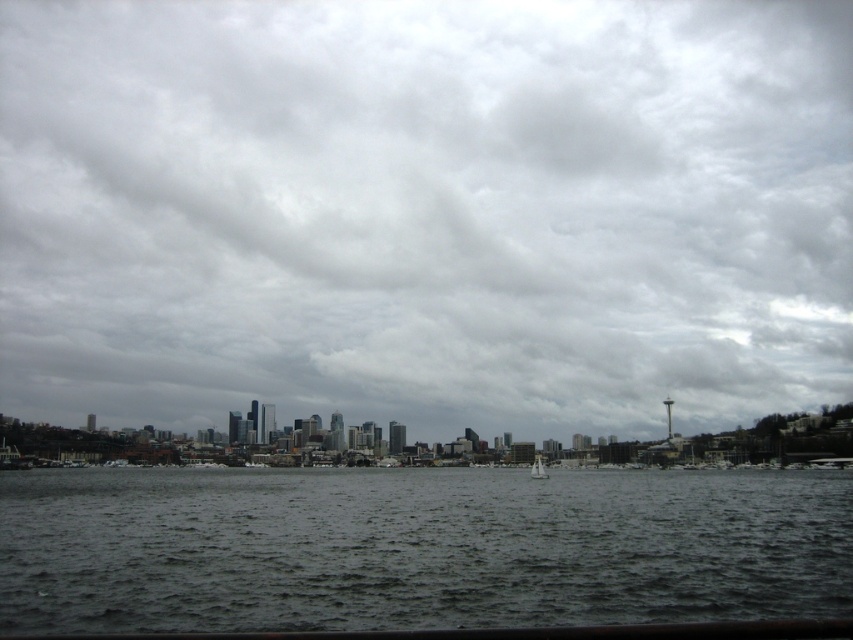
You are a photographer planning to capture the cloudy sky at center and the white plastic sailboat at center in a single shot. Based on their sizes in the image, which one would occupy more of the frame?

The cloudy sky at center occupies more of the frame because its width is larger than the white plastic sailboat at center.

You are a photographer wanting to capture the city skyline in the background while ensuring the dark gray water at center and white plastic sailboat at center are clearly visible in the foreground. Which object should you focus on to ensure both the city skyline and the foreground elements are in focus?

The dark gray water at center is larger than the white plastic sailboat at center, so focusing on the dark gray water at center will help ensure both the foreground and background elements are in focus.